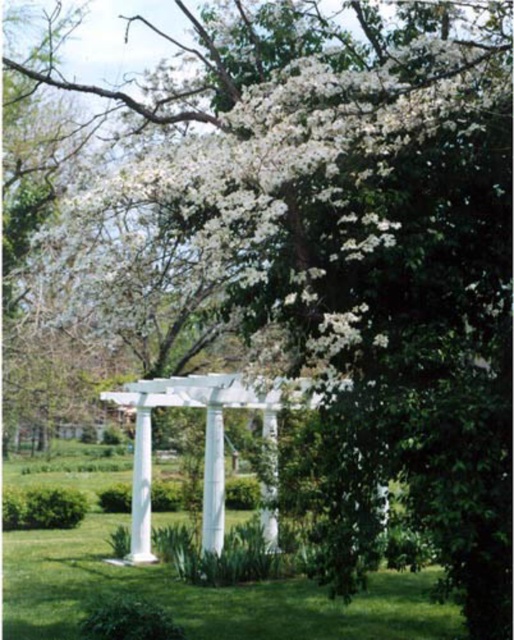
From the picture: Who is lower down, white painted wood pergola at center or white smooth pillar at center?

white painted wood pergola at center is lower down.

Who is more distant from viewer, [216,401] or [221,470]?

The point [221,470] is behind.

Between point (244, 401) and point (203, 536), which one is positioned behind?

The point (203, 536) is more distant.

Locate an element on the screen. This screenshot has height=640, width=514. white painted wood pergola at center is located at coordinates (204, 452).

Who is shorter, white smooth pillar at center or white glossy pillar at center?

white smooth pillar at center

How distant is white smooth pillar at center from white glossy pillar at center?

1.01 meters

Locate an element on the screen. Image resolution: width=514 pixels, height=640 pixels. white smooth pillar at center is located at coordinates (213, 483).

Does white glossy column at center have a greater height compared to white glossy pillar at center?

In fact, white glossy column at center may be shorter than white glossy pillar at center.

Locate an element on the screen. white glossy column at center is located at coordinates (141, 486).

Find the location of a particular element. Image resolution: width=514 pixels, height=640 pixels. white glossy column at center is located at coordinates (141, 486).